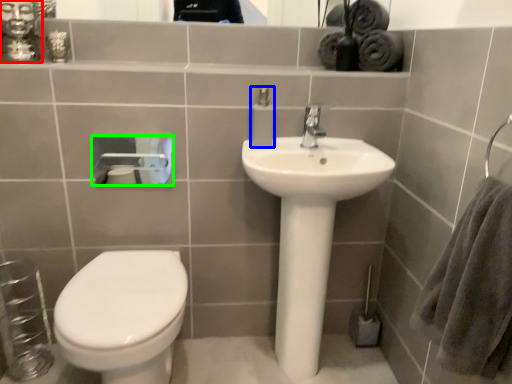
Question: Considering the real-world distances, which object is closest to selfie (highlighted by a red box)? soap dispenser (highlighted by a blue box) or toilet paper (highlighted by a green box).

Choices:
 (A) soap dispenser
 (B) toilet paper

Answer: (A)